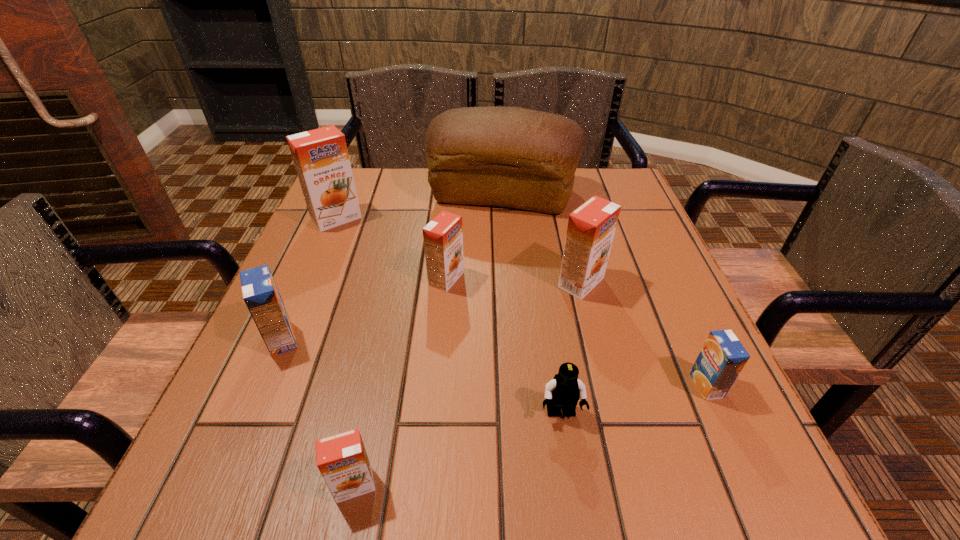
In the image, there is a desktop. At what (x,y) coordinates should I click in order to perform the action: click on free space at the right edge. Please return your answer as a coordinate pair (x, y). This screenshot has height=540, width=960. Looking at the image, I should click on click(x=691, y=438).

The height and width of the screenshot is (540, 960). What are the coordinates of `vacant space at the far right corner` in the screenshot? It's located at (601, 186).

This screenshot has width=960, height=540. What are the coordinates of `free space between the leftmost orange orange juice and the bigger blue orange_juice` in the screenshot? It's located at (309, 279).

Identify the location of vacant area that lies between the smaller blue orange_juice and the black Lego. (634, 400).

I want to click on free spot between the bread and the nearest orange orange juice, so click(x=428, y=340).

This screenshot has width=960, height=540. What are the coordinates of `free spot between the rightmost object and the third smallest orange orange juice` in the screenshot? It's located at (644, 334).

The image size is (960, 540). What are the coordinates of `free point between the third orange orange juice from left to right and the bread` in the screenshot? It's located at (474, 237).

Locate an element on the screen. The height and width of the screenshot is (540, 960). vacant space in between the bigger blue orange_juice and the nearest orange juice is located at coordinates (318, 412).

At what (x,y) coordinates should I click in order to perform the action: click on free space between the bread and the second nearest object. Please return your answer as a coordinate pair (x, y). The height and width of the screenshot is (540, 960). Looking at the image, I should click on (532, 304).

This screenshot has width=960, height=540. What are the coordinates of `free space between the left blue orange_juice and the smallest orange orange juice` in the screenshot? It's located at (318, 412).